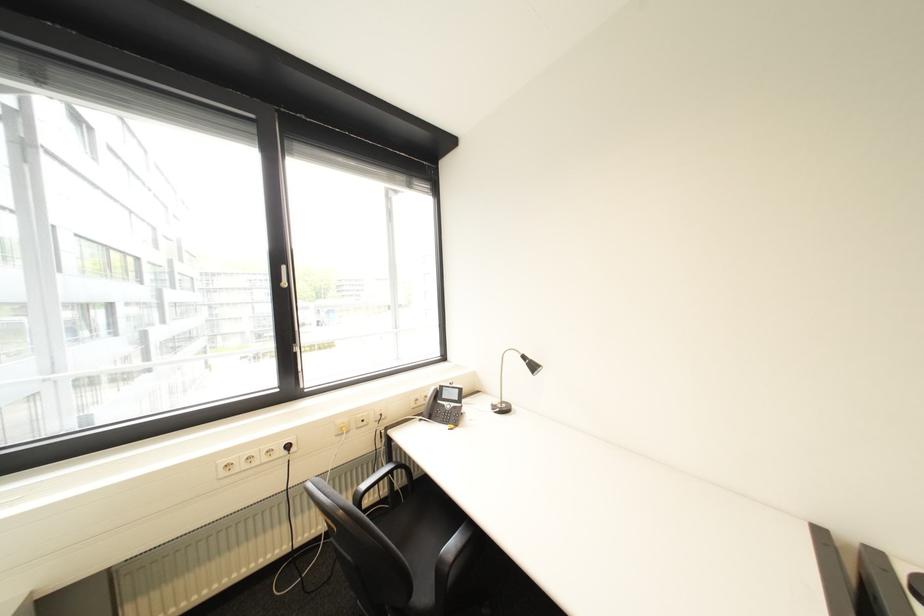
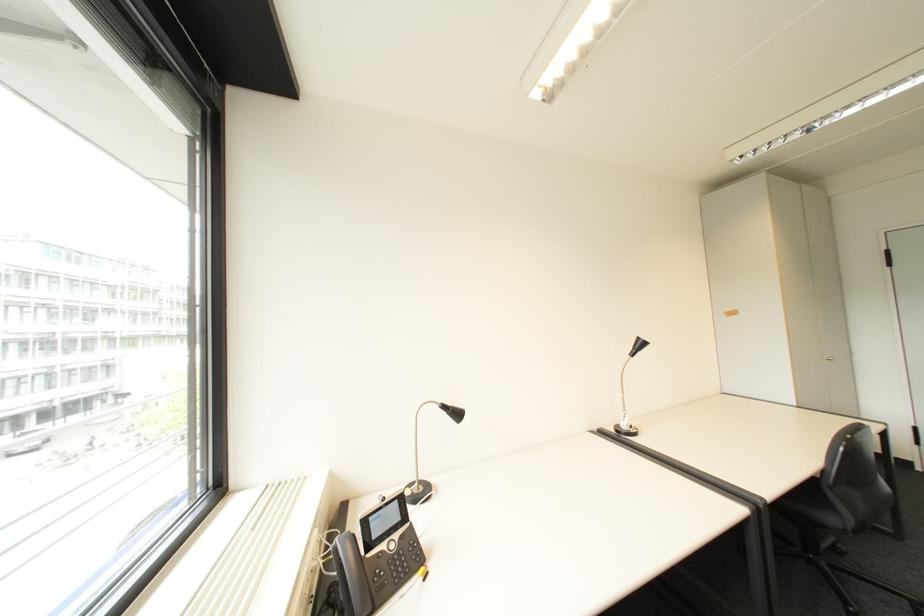
Where in the second image is the point corresponding to the point at 533,358 from the first image?

(455, 407)